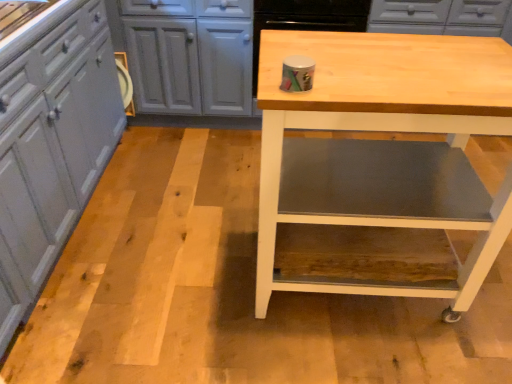
Locate an element on the screen. blank space situated above natural wood table at center (from a real-world perspective) is located at coordinates (399, 65).